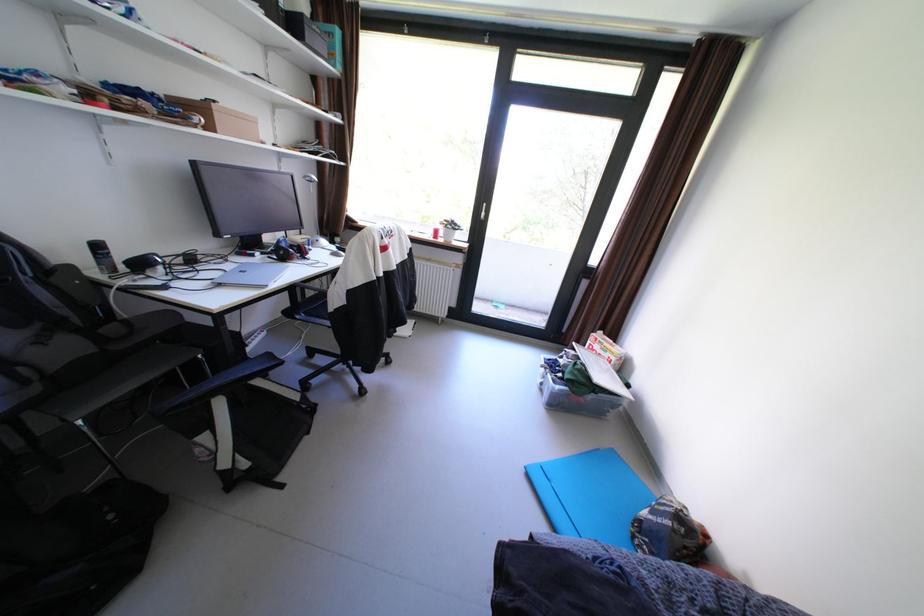
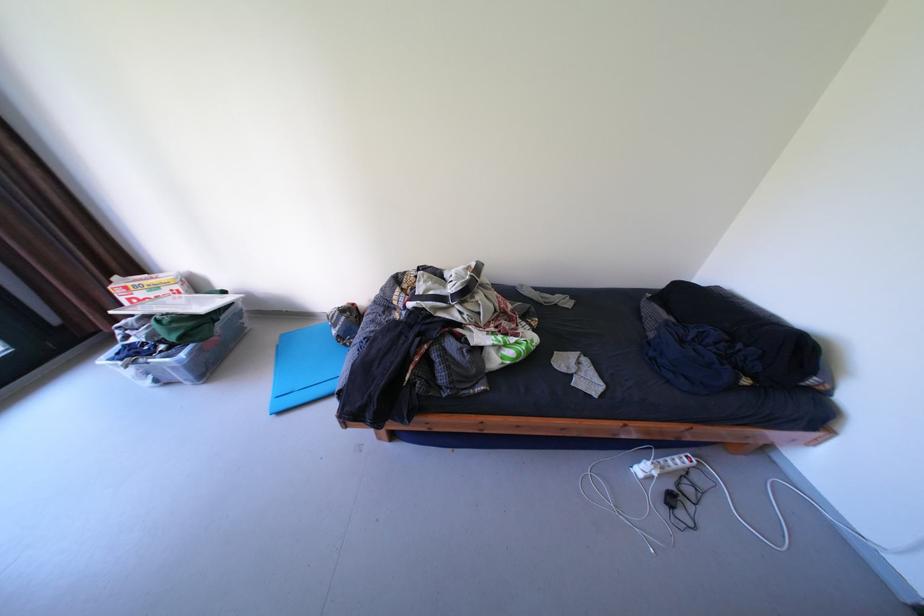
The point at (568, 387) is marked in the first image. Where is the corresponding point in the second image?

(193, 355)